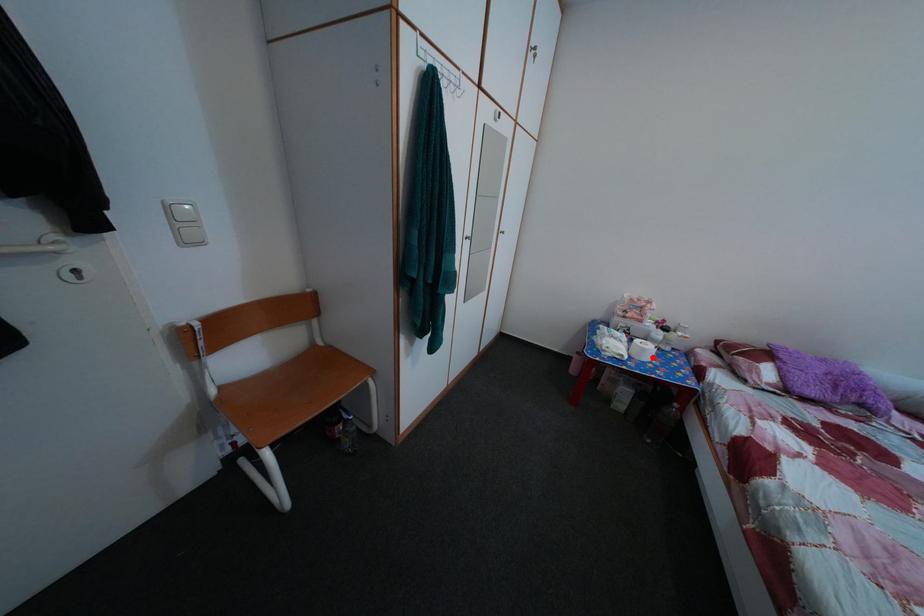
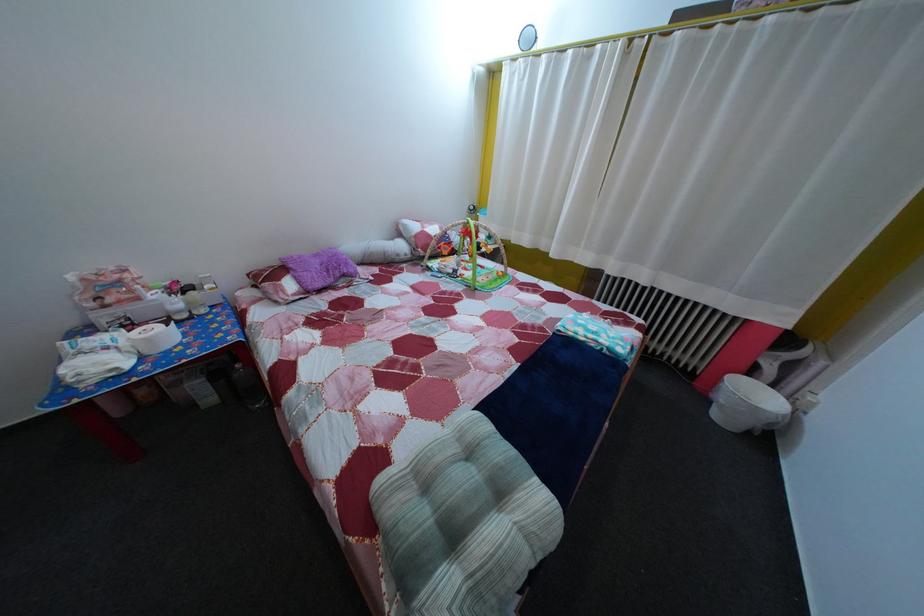
Question: I am providing you with two images of the same scene from different viewpoints. A red point is marked on the first image. At the location where the point appears in image 1, is it still visible in image 2?

Choices:
 (A) Yes
 (B) No

Answer: (A)